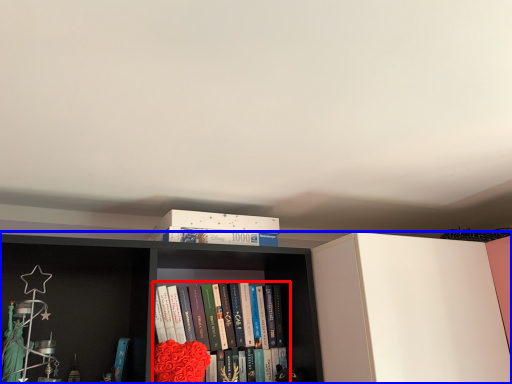
Question: Which point is further to the camera, book (highlighted by a red box) or bookcase (highlighted by a blue box)?

Choices:
 (A) book
 (B) bookcase

Answer: (A)